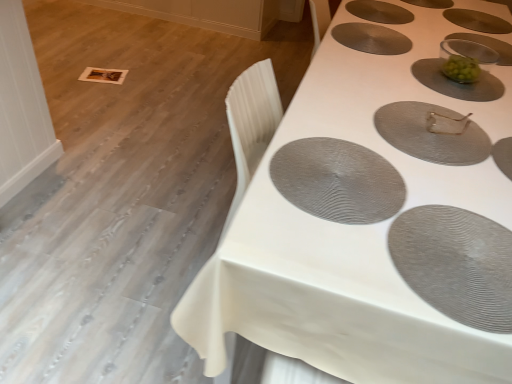
Where is `vacant region in front of textured gray oval at center, placed as the second oval when sorted from front to back`? The width and height of the screenshot is (512, 384). vacant region in front of textured gray oval at center, placed as the second oval when sorted from front to back is located at coordinates (318, 251).